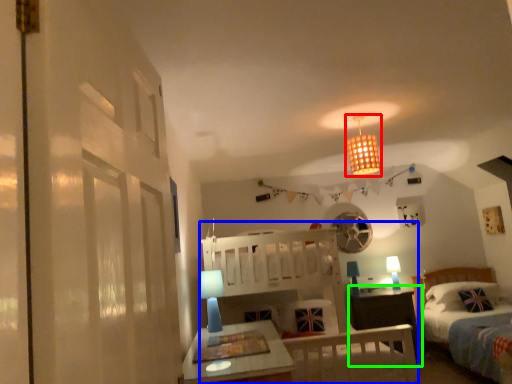
Question: Which object is the closest to the light fixture (highlighted by a red box)? Choose among these: bunk bed (highlighted by a blue box) or nightstand (highlighted by a green box).

Choices:
 (A) bunk bed
 (B) nightstand

Answer: (A)